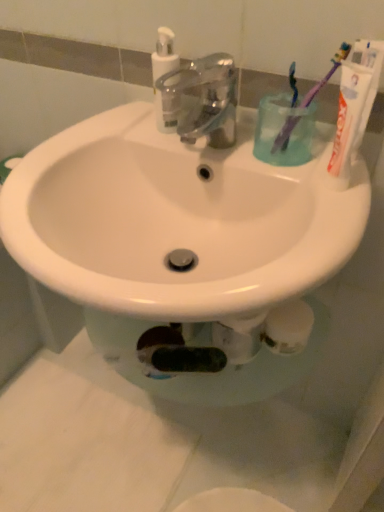
Question: Can you confirm if translucent plastic pump bottle at upper center is wider than white matte toothpaste at upper right?

Choices:
 (A) no
 (B) yes

Answer: (B)

Question: Is translucent plastic pump bottle at upper center positioned beyond the bounds of white matte toothpaste at upper right?

Choices:
 (A) no
 (B) yes

Answer: (B)

Question: Is translucent plastic pump bottle at upper center facing away from white matte toothpaste at upper right?

Choices:
 (A) yes
 (B) no

Answer: (B)

Question: From the image's perspective, is translucent plastic pump bottle at upper center over white matte toothpaste at upper right?

Choices:
 (A) yes
 (B) no

Answer: (A)

Question: From the image's perspective, is translucent plastic pump bottle at upper center beneath white matte toothpaste at upper right?

Choices:
 (A) no
 (B) yes

Answer: (A)

Question: Is the position of translucent plastic pump bottle at upper center more distant than that of white matte toothpaste at upper right?

Choices:
 (A) no
 (B) yes

Answer: (B)

Question: Does translucent plastic cup at upper right have a greater height compared to purple plastic toothbrush at upper right, which is the first toothbrush from right to left?

Choices:
 (A) yes
 (B) no

Answer: (B)

Question: Does translucent plastic cup at upper right appear on the right side of purple plastic toothbrush at upper right, acting as the 2th toothbrush starting from the left?

Choices:
 (A) yes
 (B) no

Answer: (B)

Question: Is translucent plastic cup at upper right not inside purple plastic toothbrush at upper right, which is the first toothbrush from right to left?

Choices:
 (A) no
 (B) yes

Answer: (B)

Question: Does translucent plastic cup at upper right have a lesser height compared to purple plastic toothbrush at upper right, acting as the 2th toothbrush starting from the left?

Choices:
 (A) yes
 (B) no

Answer: (A)

Question: Is purple plastic toothbrush at upper right, which is the first toothbrush from right to left, inside translucent plastic cup at upper right?

Choices:
 (A) yes
 (B) no

Answer: (B)

Question: Is translucent plastic cup at upper right positioned with its back to purple plastic toothbrush at upper right, which is the first toothbrush from right to left?

Choices:
 (A) yes
 (B) no

Answer: (B)

Question: Are metallic faucet at center and translucent plastic cup at upper right located far from each other?

Choices:
 (A) yes
 (B) no

Answer: (B)